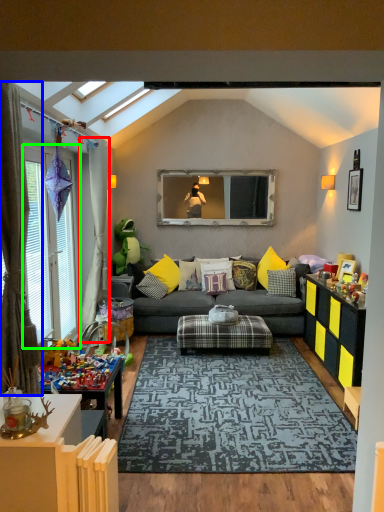
Question: Which is farther away from curtain (highlighted by a red box)? curtain (highlighted by a blue box) or window (highlighted by a green box)?

Choices:
 (A) curtain
 (B) window

Answer: (A)